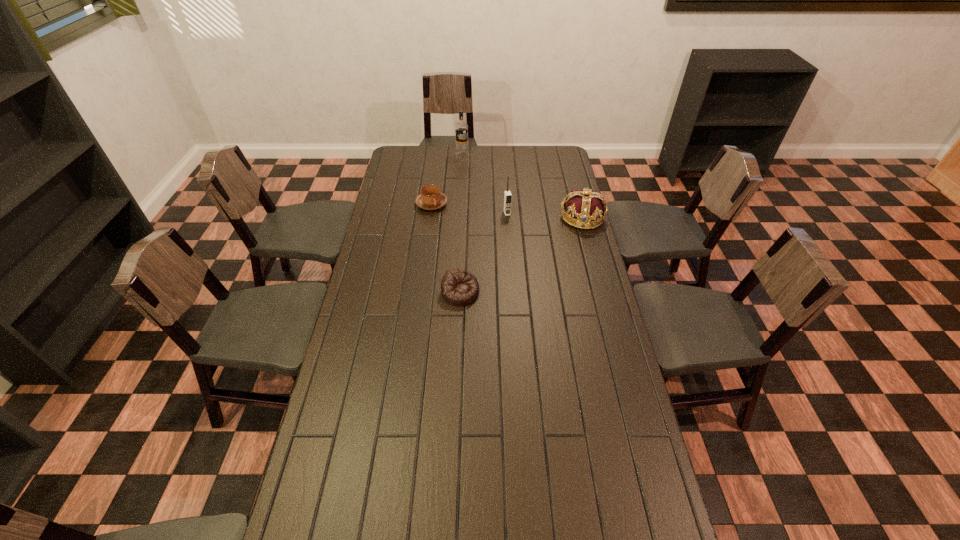
At what (x,y) coordinates should I click in order to perform the action: click on free space on the desktop that is between the nearest object and the crown and is positioned on the front-facing side of the fourth object from left to right. Please return your answer as a coordinate pair (x, y). This screenshot has height=540, width=960. Looking at the image, I should click on (522, 254).

Where is `free spot on the desktop that is between the beanbag and the third tallest object and is positioned on the side of the leftmost object with the handle`? The height and width of the screenshot is (540, 960). free spot on the desktop that is between the beanbag and the third tallest object and is positioned on the side of the leftmost object with the handle is located at coordinates (512, 261).

Identify the location of vacant space on the desktop that is between the beanbag and the rightmost object and is positioned on the label of the farthest object. The height and width of the screenshot is (540, 960). (529, 251).